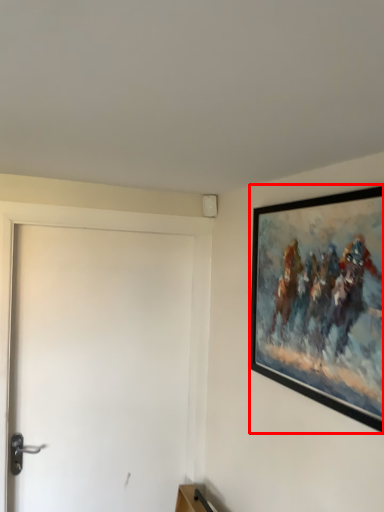
Question: From the image's perspective, considering the relative positions of picture frame (annotated by the red box) and door in the image provided, where is picture frame (annotated by the red box) located with respect to the staircase?

Choices:
 (A) above
 (B) below

Answer: (A)